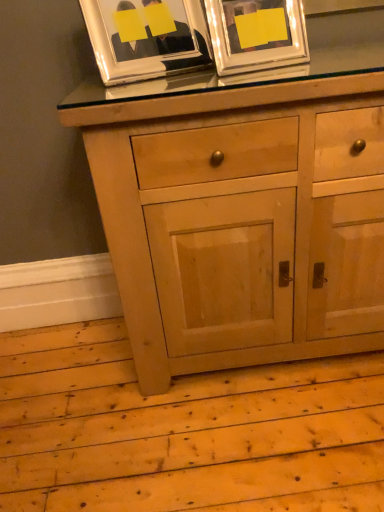
Find the location of a particular element. The image size is (384, 512). vacant space in front of silver metallic picture frame at upper left, the 2th picture frame when ordered from right to left is located at coordinates (153, 97).